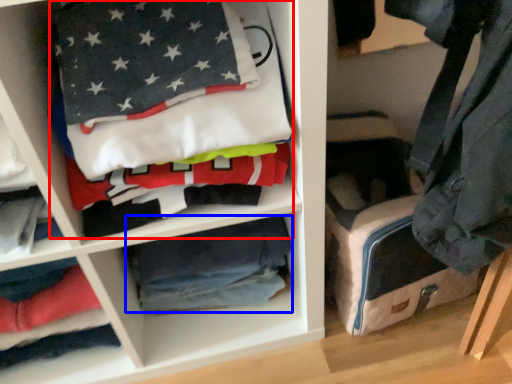
Question: Which point is closer to the camera, laundry (highlighted by a red box) or material (highlighted by a blue box)?

Choices:
 (A) laundry
 (B) material

Answer: (A)